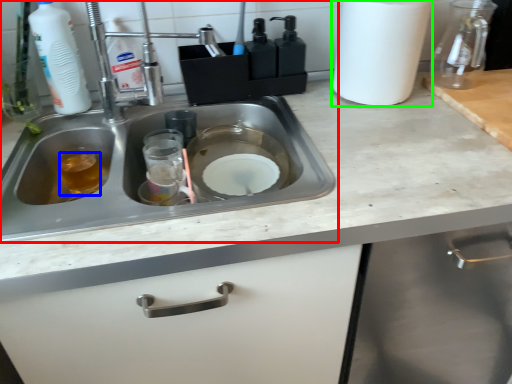
Question: Based on their relative distances, which object is farther from sink (highlighted by a red box)? Choose from liquid (highlighted by a blue box) and paper towel (highlighted by a green box).

Choices:
 (A) liquid
 (B) paper towel

Answer: (B)